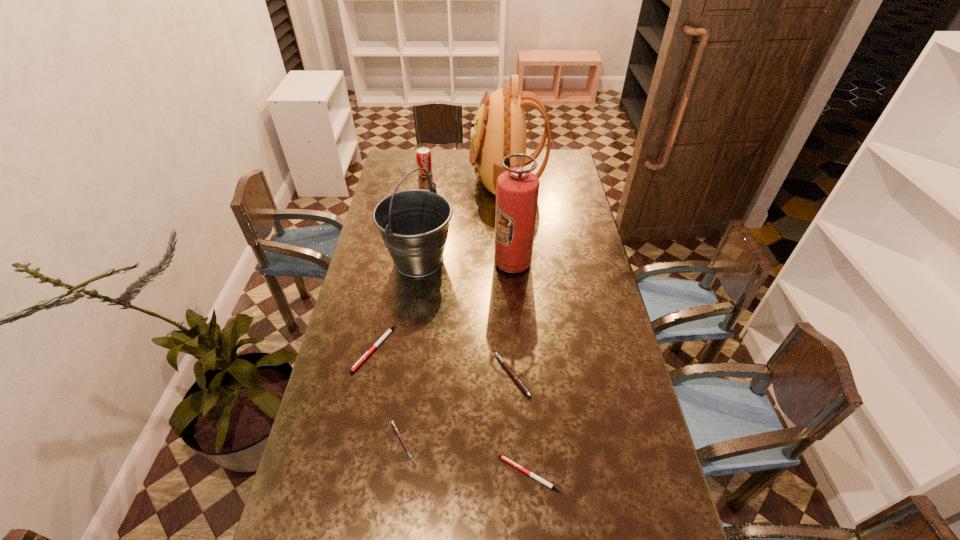
This screenshot has width=960, height=540. Find the location of `beige backpack`. beige backpack is located at coordinates (499, 129).

Locate an element on the screen. Image resolution: width=960 pixels, height=540 pixels. red fire extinguisher is located at coordinates pyautogui.click(x=517, y=189).

You are a GUI agent. You are given a task and a screenshot of the screen. Output one action in this format:
    pyautogui.click(x=<x>, y=<y>)
    Task: Click on the bucket
    The width and height of the screenshot is (960, 540).
    Given the screenshot: What is the action you would take?
    pyautogui.click(x=413, y=224)

The width and height of the screenshot is (960, 540). Identify the location of soda can. (423, 155).

Image resolution: width=960 pixels, height=540 pixels. What are the coordinates of `the fifth shortest object` in the screenshot? It's located at (423, 155).

I want to click on the right pink pen, so click(x=507, y=367).

Find the location of a particular element. The width and height of the screenshot is (960, 540). the bigger pink pen is located at coordinates (507, 367).

Find the location of a particular element. This screenshot has height=540, width=960. the farther white pen is located at coordinates pos(388,331).

Find the location of a particular element. This screenshot has height=540, width=960. the leftmost pen is located at coordinates (388, 331).

At what (x,y) coordinates should I click in order to perform the action: click on the third pen from right to left. Please return your answer as a coordinate pair (x, y). Looking at the image, I should click on (393, 424).